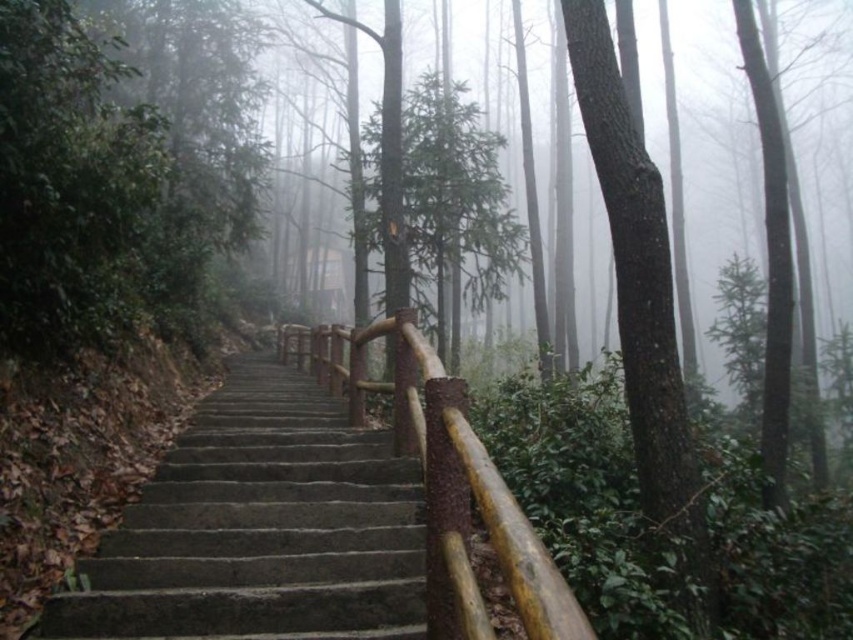
Question: Which point appears closest to the camera in this image?

Choices:
 (A) (280, 547)
 (B) (675, 356)

Answer: (A)

Question: Observing the image, what is the correct spatial positioning of smooth bark tree at center in reference to green matte tree at center?

Choices:
 (A) right
 (B) left

Answer: (B)

Question: Does smooth bark tree at center appear over green matte tree at center?

Choices:
 (A) no
 (B) yes

Answer: (A)

Question: Among these points, which one is farthest from the camera?

Choices:
 (A) (572, 3)
 (B) (340, 634)
 (C) (355, 365)
 (D) (466, 268)

Answer: (D)

Question: Estimate the real-world distances between objects in this image. Which object is closer to the dark gray concrete stairs at center?

Choices:
 (A) smooth bark tree at center
 (B) brown wood/rustic rail at center
 (C) green matte tree at center

Answer: (A)

Question: Is dark gray concrete stairs at center to the right of green matte tree at center from the viewer's perspective?

Choices:
 (A) yes
 (B) no

Answer: (B)